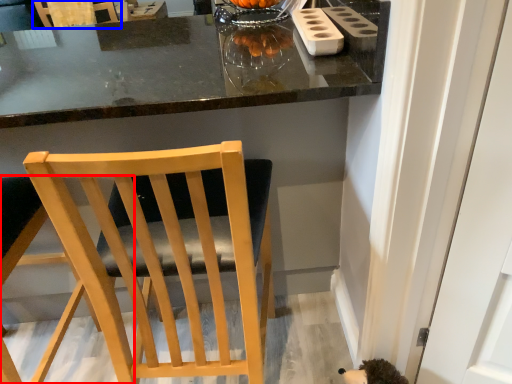
Question: Which point is closer to the camera, chair (highlighted by a red box) or chair (highlighted by a blue box)?

Choices:
 (A) chair
 (B) chair

Answer: (A)